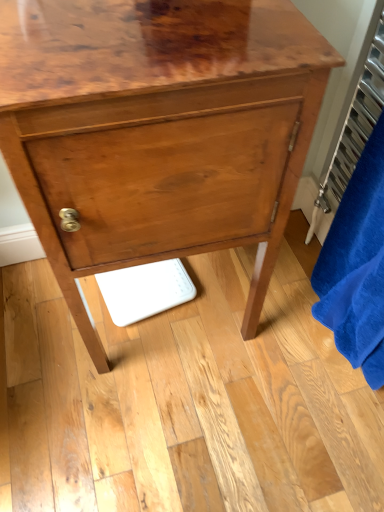
You are a GUI agent. You are given a task and a screenshot of the screen. Output one action in this format:
    pyautogui.click(x=<x>, y=<y>)
    Task: Click on the empty space that is ontop of glossy wood chest of drawers at center
    This screenshot has height=512, width=384.
    Given the screenshot: What is the action you would take?
    pyautogui.click(x=155, y=26)